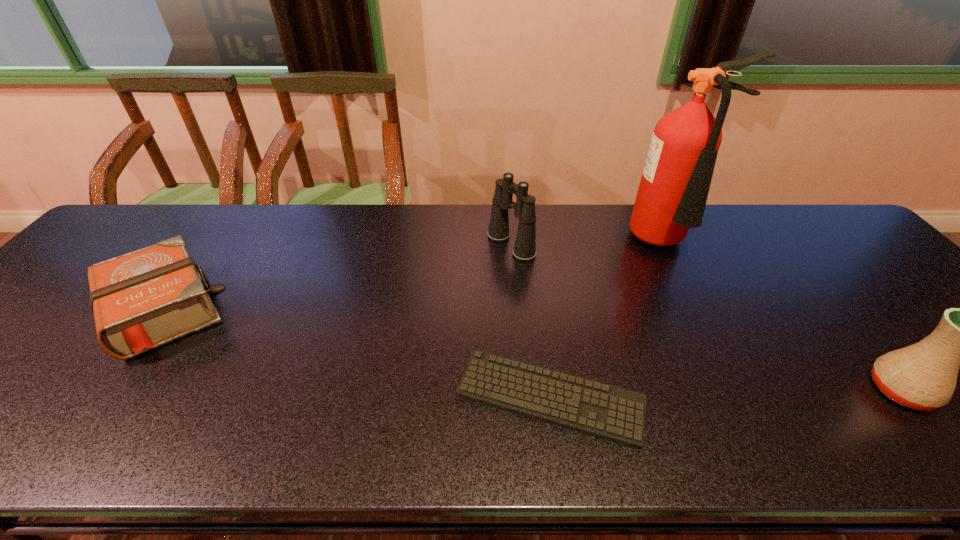
Find the location of a particular element. object that is the fourth closest to the leftmost object is located at coordinates pos(923,376).

I want to click on the closest object to the fire extinguisher, so click(524, 249).

The width and height of the screenshot is (960, 540). I want to click on free space that satisfies the following two spatial constraints: 1. at the nozzle of the rightmost object; 2. on the left side of the fourth object from left to right, so click(x=744, y=390).